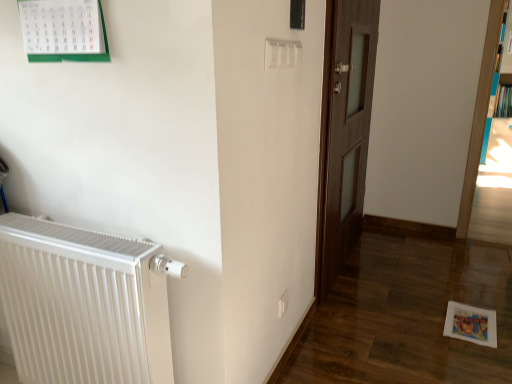
Question: Is dark wood door at center facing towards hardcover book at upper right?

Choices:
 (A) no
 (B) yes

Answer: (A)

Question: Is dark wood door at center facing away from hardcover book at upper right?

Choices:
 (A) yes
 (B) no

Answer: (B)

Question: Does dark wood door at center have a larger size compared to hardcover book at upper right?

Choices:
 (A) no
 (B) yes

Answer: (B)

Question: Is dark wood door at center far away from hardcover book at upper right?

Choices:
 (A) no
 (B) yes

Answer: (B)

Question: Does dark wood door at center have a smaller size compared to hardcover book at upper right?

Choices:
 (A) no
 (B) yes

Answer: (A)

Question: Is hardcover book at upper right bigger or smaller than white plastic electric outlet at lower center?

Choices:
 (A) big
 (B) small

Answer: (A)

Question: Is hardcover book at upper right wider or thinner than white plastic electric outlet at lower center?

Choices:
 (A) wide
 (B) thin

Answer: (A)

Question: In terms of height, does hardcover book at upper right look taller or shorter compared to white plastic electric outlet at lower center?

Choices:
 (A) tall
 (B) short

Answer: (A)

Question: From the image's perspective, is hardcover book at upper right positioned above or below white plastic electric outlet at lower center?

Choices:
 (A) below
 (B) above

Answer: (B)

Question: In the image, is white metallic radiator at left positioned in front of or behind white plastic electric outlet at lower center?

Choices:
 (A) front
 (B) behind

Answer: (A)

Question: Looking at the image, does white metallic radiator at left seem bigger or smaller compared to white plastic electric outlet at lower center?

Choices:
 (A) big
 (B) small

Answer: (A)

Question: From the image's perspective, is white metallic radiator at left above or below white plastic electric outlet at lower center?

Choices:
 (A) below
 (B) above

Answer: (B)

Question: Is white metallic radiator at left wider or thinner than white plastic electric outlet at lower center?

Choices:
 (A) thin
 (B) wide

Answer: (B)

Question: Choose the correct answer: Is dark wood door at center inside blue glossy bookcase at right, the 2th bookcase viewed from the left, or outside it?

Choices:
 (A) outside
 (B) inside

Answer: (A)

Question: Does point (330, 13) appear closer or farther from the camera than point (496, 51)?

Choices:
 (A) farther
 (B) closer

Answer: (B)